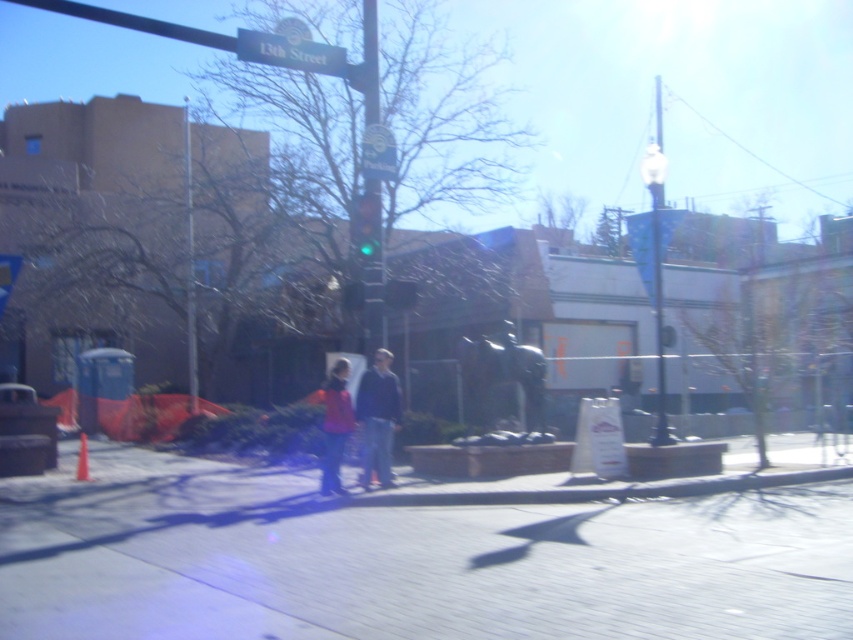
Question: Which object is positioned closest to the matte pink jacket at center?

Choices:
 (A) green plastic street sign at upper center
 (B) green glass traffic light at center
 (C) gray concrete pavement at center
 (D) blue plastic parking sign at upper center

Answer: (C)

Question: Can you confirm if green plastic street sign at upper center is smaller than metallic pole at upper right?

Choices:
 (A) yes
 (B) no

Answer: (A)

Question: Is green plastic street sign at upper center smaller than green glass traffic light at center?

Choices:
 (A) yes
 (B) no

Answer: (A)

Question: Which point is farther from the camera taking this photo?

Choices:
 (A) (378, 396)
 (B) (367, 76)
 (C) (236, 40)

Answer: (B)

Question: Which point is closer to the camera?

Choices:
 (A) green plastic street sign at upper center
 (B) dark blue jacket at center
 (C) metallic pole at upper right
 (D) blue plastic parking sign at upper center

Answer: (B)

Question: Is the position of gray concrete pavement at center less distant than that of metallic pole at upper right?

Choices:
 (A) no
 (B) yes

Answer: (B)